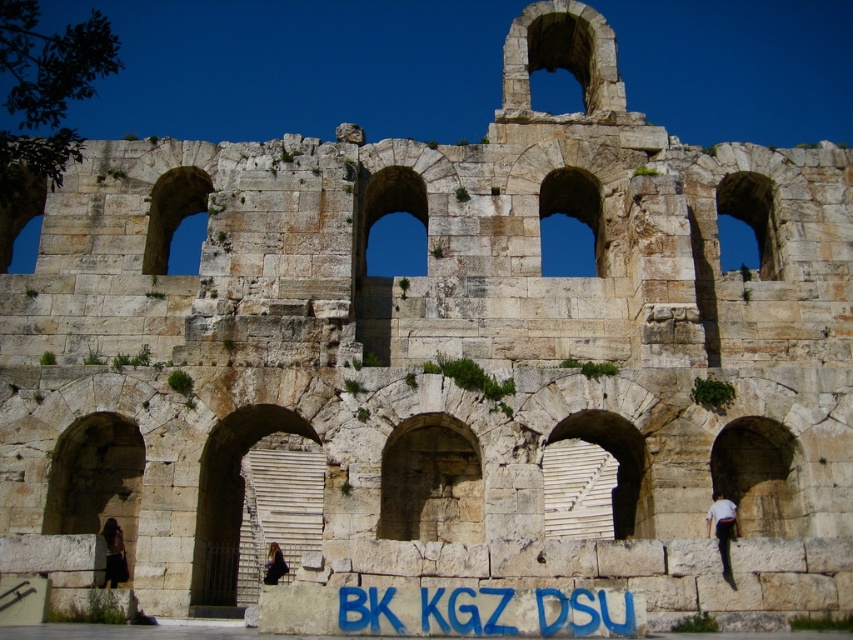
In the scene shown: Can you confirm if blue paint graffiti at center is shorter than white fabric at right?

Yes.

Is point (561, 611) in front of point (730, 522)?

Yes, it is in front of point (730, 522).

The image size is (853, 640). Identify the location of blue paint graffiti at center. (486, 611).

The image size is (853, 640). What do you see at coordinates (486, 611) in the screenshot?
I see `blue paint graffiti at center` at bounding box center [486, 611].

Which is behind, point (596, 605) or point (271, 552)?

The point (271, 552) is behind.

You are a GUI agent. You are given a task and a screenshot of the screen. Output one action in this format:
    pyautogui.click(x=<x>, y=<y>)
    Task: Click on the blue paint graffiti at center
    This screenshot has height=640, width=853.
    Given the screenshot: What is the action you would take?
    486,611

Can you confirm if white fabric at right is positioned below dark brown leather jacket at lower left?

No, white fabric at right is not below dark brown leather jacket at lower left.

Does white fabric at right lie behind dark brown leather jacket at lower left?

No, white fabric at right is in front of dark brown leather jacket at lower left.

Is point (717, 499) closer to camera compared to point (276, 560)?

No, (717, 499) is behind (276, 560).

You are a GUI agent. You are given a task and a screenshot of the screen. Output one action in this format:
    pyautogui.click(x=<x>, y=<y>)
    Task: Click on the white fabric at right
    This screenshot has height=640, width=853.
    Given the screenshot: What is the action you would take?
    pyautogui.click(x=722, y=525)